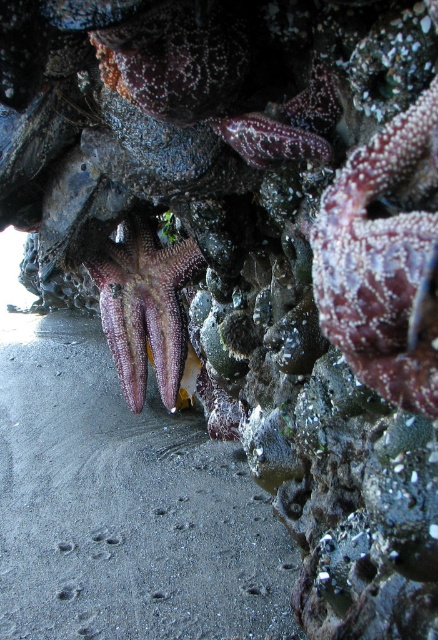
Looking at this image, does smooth sand at lower left have a greater height compared to pearly white starfish at center?

Yes.

Does smooth sand at lower left have a lesser width compared to pearly white starfish at center?

In fact, smooth sand at lower left might be wider than pearly white starfish at center.

Which is in front, point (281, 593) or point (195, 272)?

Positioned in front is point (281, 593).

Locate an element on the screen. smooth sand at lower left is located at coordinates (123, 506).

Can you confirm if rough textured starfish at center is bigger than pearly white starfish at center?

No.

Between point (413, 401) and point (116, 330), which one is positioned behind?

Positioned behind is point (116, 330).

Where is `rough textured starfish at center`? The height and width of the screenshot is (640, 438). rough textured starfish at center is located at coordinates (384, 260).

What do you see at coordinates (123, 506) in the screenshot?
I see `smooth sand at lower left` at bounding box center [123, 506].

Is point (223, 608) less distant than point (371, 257)?

No, it is behind (371, 257).

Measure the distance between smooth sand at lower left and camera.

smooth sand at lower left is 1.18 meters away from camera.

You are a GUI agent. You are given a task and a screenshot of the screen. Output one action in this format:
    pyautogui.click(x=<x>, y=<y>)
    Task: Click on the smooth sand at lower left
    The image size is (438, 640).
    Given the screenshot: What is the action you would take?
    point(123,506)